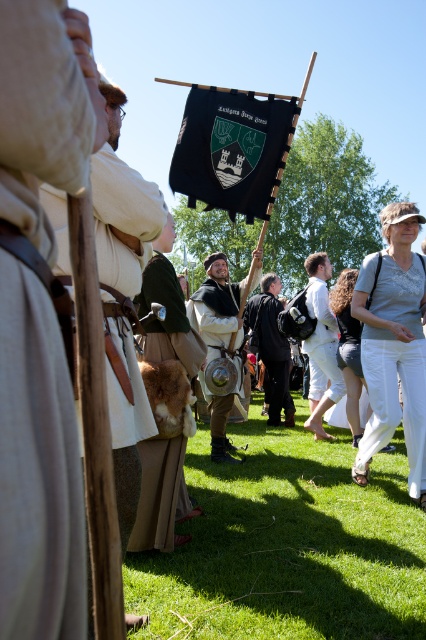
Which of these two, black canvas flag at center or black leather armor at center, stands taller?

black leather armor at center

Is point (241, 176) less distant than point (276, 280)?

Yes, it is.

Locate an element on the screen. The image size is (426, 640). black canvas flag at center is located at coordinates (233, 148).

Does light beige fabric at left come behind white cotton pants at lower right?

No.

Can you confirm if light beige fabric at left is bigger than white cotton pants at lower right?

No, light beige fabric at left is not bigger than white cotton pants at lower right.

Between point (31, 192) and point (408, 326), which one is positioned in front?

Point (31, 192) is in front.

You are a GUI agent. You are given a task and a screenshot of the screen. Output one action in this format:
    pyautogui.click(x=<x>, y=<y>)
    Task: Click on the light beige fabric at left
    
    Given the screenshot: What is the action you would take?
    pyautogui.click(x=37, y=467)

Is matte brown leather armor at center positioned at the back of white cotton shirt at center?

No, matte brown leather armor at center is closer to the viewer.

Which is in front, point (189, 314) or point (307, 268)?

Positioned in front is point (189, 314).

Find the location of a particular element. The width and height of the screenshot is (426, 640). matte brown leather armor at center is located at coordinates (216, 307).